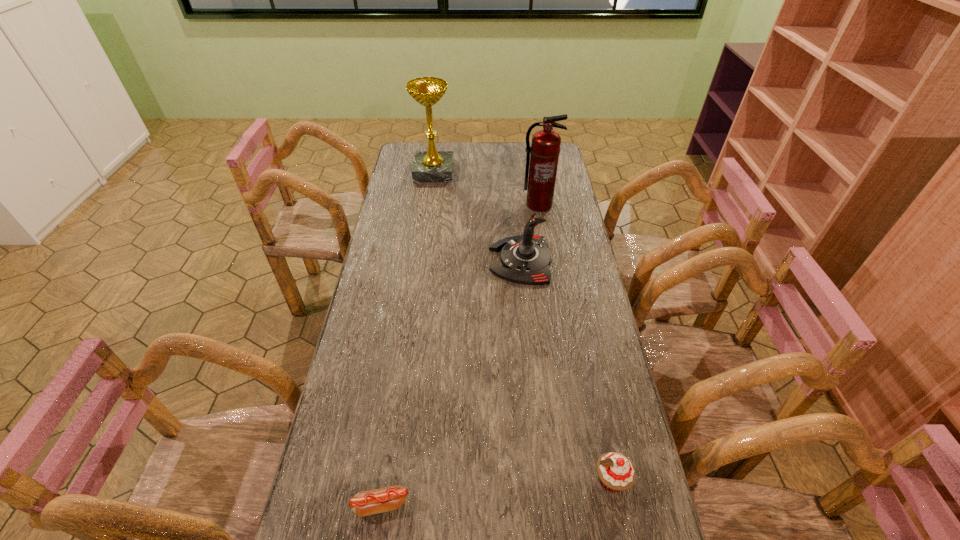
In the image, there is a desktop. Where is `free space at the far edge`? This screenshot has height=540, width=960. free space at the far edge is located at coordinates (516, 151).

The image size is (960, 540). I want to click on free space at the left edge, so click(x=382, y=286).

Find the location of a particular element. The image size is (960, 540). vacant space at the right edge of the desktop is located at coordinates (567, 334).

Find the location of `vacant area that lies between the award and the fire extinguisher`. vacant area that lies between the award and the fire extinguisher is located at coordinates (486, 188).

Identify the location of vacant area that lies between the fourth tallest object and the second farthest object. (575, 342).

Identify the location of empty space between the third shortest object and the award. The image size is (960, 540). pyautogui.click(x=477, y=216).

Identify the location of vacant region between the fourth nearest object and the award. The height and width of the screenshot is (540, 960). (486, 188).

Identify the location of blank region between the shortest object and the joystick. (451, 382).

The image size is (960, 540). I want to click on vacant area that lies between the cupcake and the shortest object, so click(x=496, y=492).

What are the coordinates of `free space between the sausage and the second shortest object` in the screenshot? It's located at (496, 492).